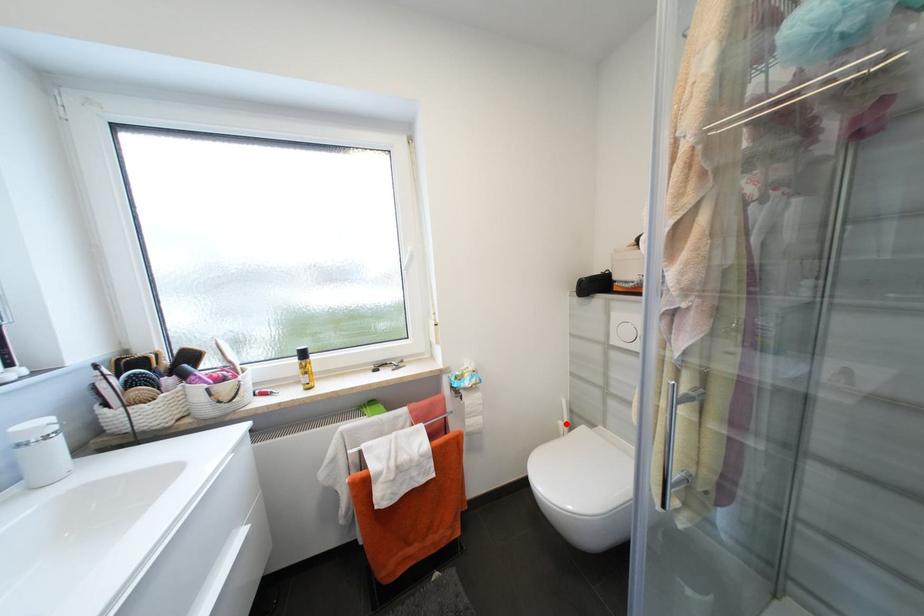
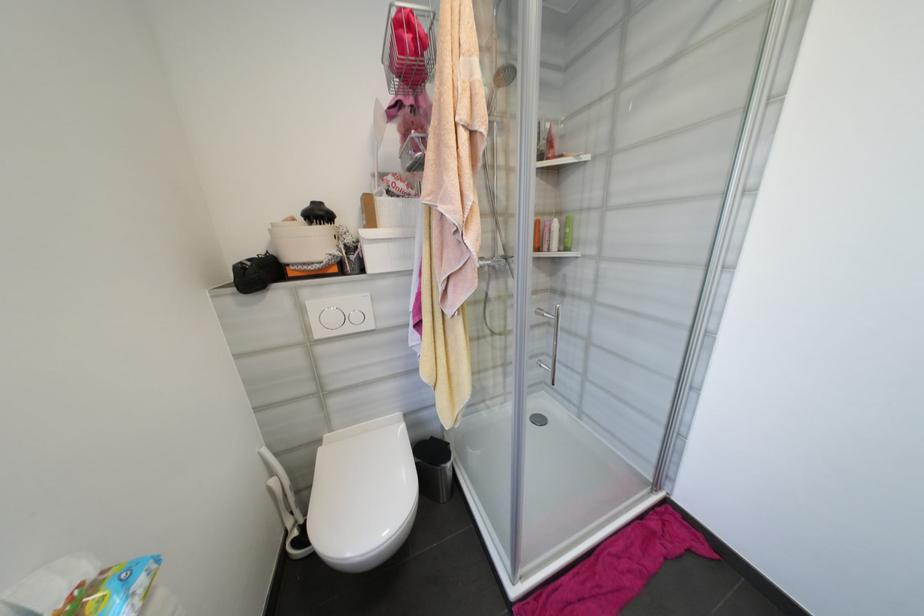
Question: I am providing you with two images of the same scene from different viewpoints. A red point is marked on the first image. Is the red point's position out of view in image 2?

Choices:
 (A) Yes
 (B) No

Answer: (B)